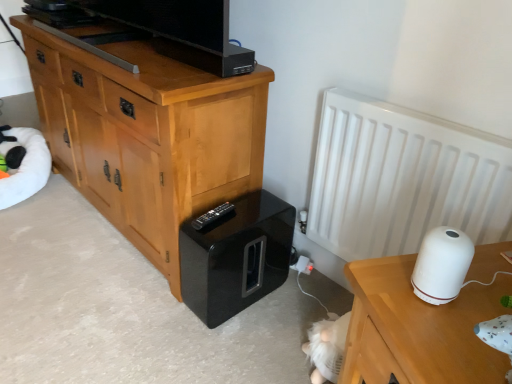
At what (x,y) coordinates should I click in order to perform the action: click on vacant region above white matte radiator at right (from a real-world perspective). Please return your answer as a coordinate pair (x, y). Looking at the image, I should click on (445, 117).